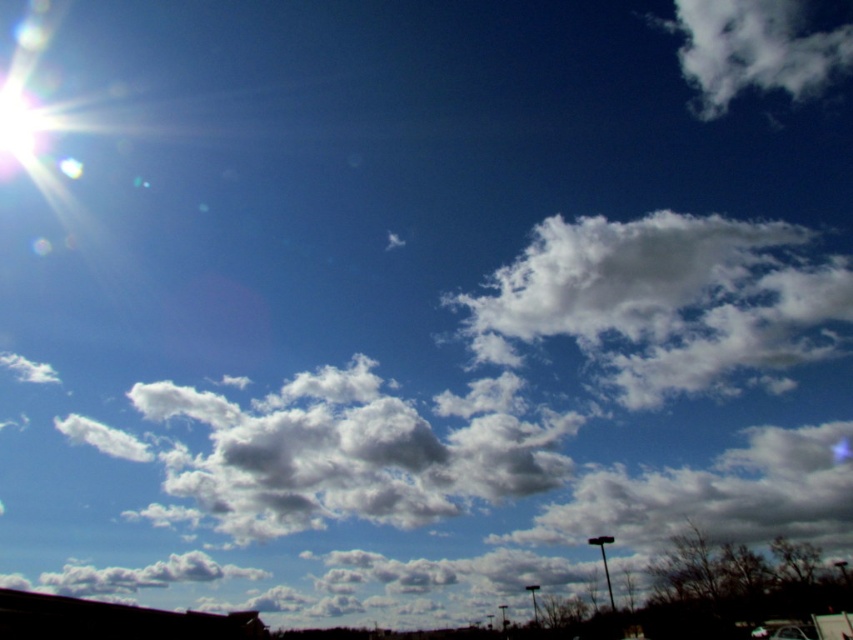
Question: Among these points, which one is nearest to the camera?

Choices:
 (A) (804, 632)
 (B) (555, 307)
 (C) (728, 93)

Answer: (A)

Question: Estimate the real-world distances between objects in this image. Which object is farther from the white fluffy cloud at upper center?

Choices:
 (A) white fluffy cloud at upper right
 (B) metallic silver car at bottom right

Answer: (B)

Question: Does white fluffy cloud at upper center appear over white fluffy cloud at upper right?

Choices:
 (A) yes
 (B) no

Answer: (B)

Question: Is white fluffy cloud at upper center positioned at the back of metallic silver car at bottom right?

Choices:
 (A) yes
 (B) no

Answer: (A)

Question: Can you confirm if white fluffy cloud at upper center is bigger than metallic silver car at bottom right?

Choices:
 (A) no
 (B) yes

Answer: (B)

Question: Among these objects, which one is nearest to the camera?

Choices:
 (A) white fluffy cloud at upper right
 (B) metallic silver car at bottom right

Answer: (B)